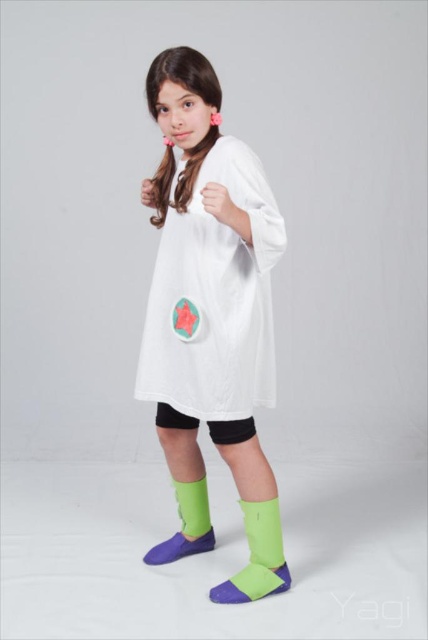
Is point (160, 564) behind point (205, 499)?

No, (160, 564) is closer to viewer.

Based on the photo, does green fabric boot at lower center have a larger size compared to green fabric sock at lower center?

Correct, green fabric boot at lower center is larger in size than green fabric sock at lower center.

Does point (214, 536) lie in front of point (198, 488)?

No, (214, 536) is behind (198, 488).

Where is `green fabric boot at lower center`? The width and height of the screenshot is (428, 640). green fabric boot at lower center is located at coordinates (187, 525).

Can you confirm if white matte dress at center is wider than green fabric boot at lower center?

Yes, white matte dress at center is wider than green fabric boot at lower center.

Which is behind, point (157, 397) or point (213, 547)?

Positioned behind is point (213, 547).

Locate an element on the screen. white matte dress at center is located at coordinates (213, 305).

Does white matte dress at center have a smaller size compared to green matte boot at lower center?

Actually, white matte dress at center might be larger than green matte boot at lower center.

Which of these two, white matte dress at center or green matte boot at lower center, stands taller?

Standing taller between the two is white matte dress at center.

Where is `white matte dress at center`? white matte dress at center is located at coordinates (213, 305).

Identify the location of white matte dress at center. This screenshot has height=640, width=428. (213, 305).